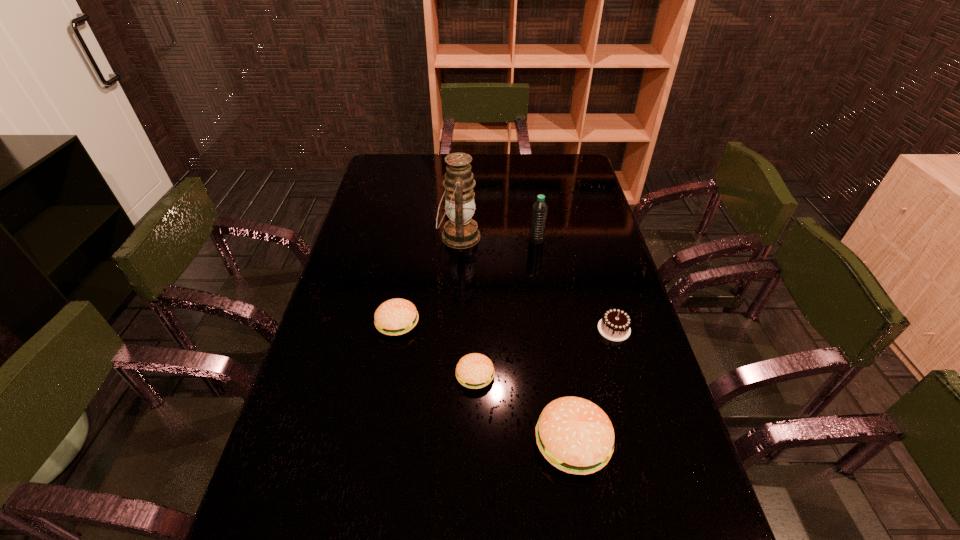
Considering the uniform spacing of pattys, where should an additional patty be positioned on the right? Please locate a free spot. Please provide its 2D coordinates. Your answer should be formatted as a tuple, i.e. [(x, y)], where the tuple contains the x and y coordinates of a point satisfying the conditions above.

[(700, 527)]